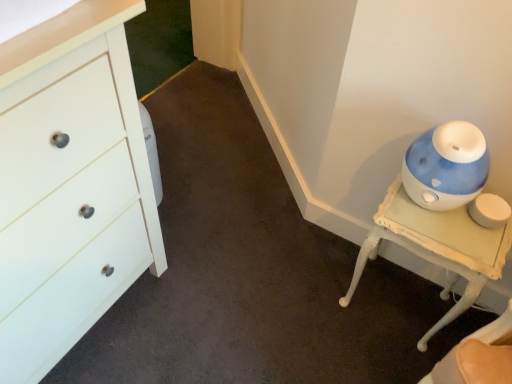
Where is `vacant area that lies between blue glossy humidifier at right and white matte chest of drawers at left`? This screenshot has height=384, width=512. vacant area that lies between blue glossy humidifier at right and white matte chest of drawers at left is located at coordinates (245, 303).